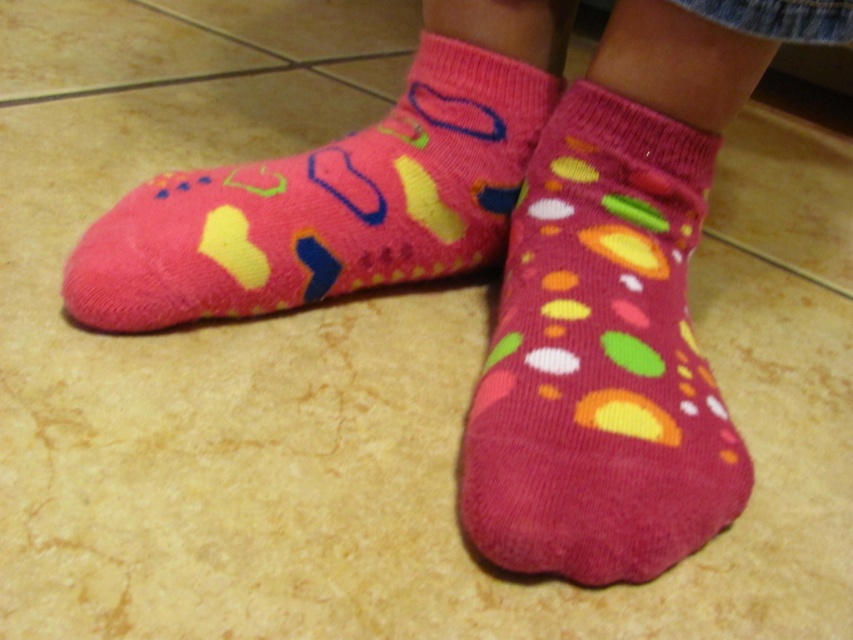
Between pink soft socks at center and pink fuzzy socks at left, which one has more height?

pink soft socks at center is taller.

Looking at this image, can you confirm if pink soft socks at center is positioned to the left of pink fuzzy socks at left?

In fact, pink soft socks at center is to the right of pink fuzzy socks at left.

Where is `pink soft socks at center`? The image size is (853, 640). pink soft socks at center is located at coordinates (601, 358).